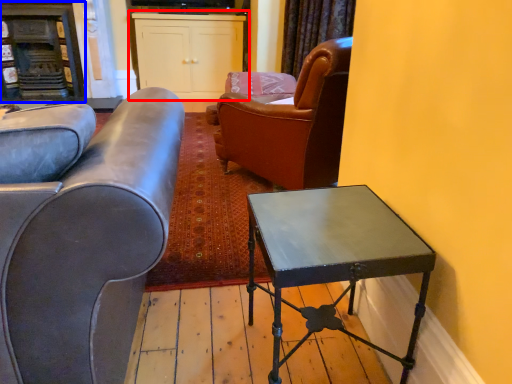
Question: Which object appears farthest to the camera in this image, cabinetry (highlighted by a red box) or fireplace (highlighted by a blue box)?

Choices:
 (A) cabinetry
 (B) fireplace

Answer: (A)